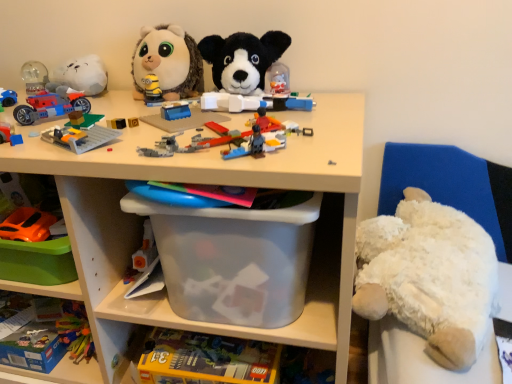
The width and height of the screenshot is (512, 384). In order to click on blank space situated above transparent plastic storage box at lower center, arranged as the 2th storage box when viewed from the top (from a real-world perspective) in this screenshot , I will do `click(215, 348)`.